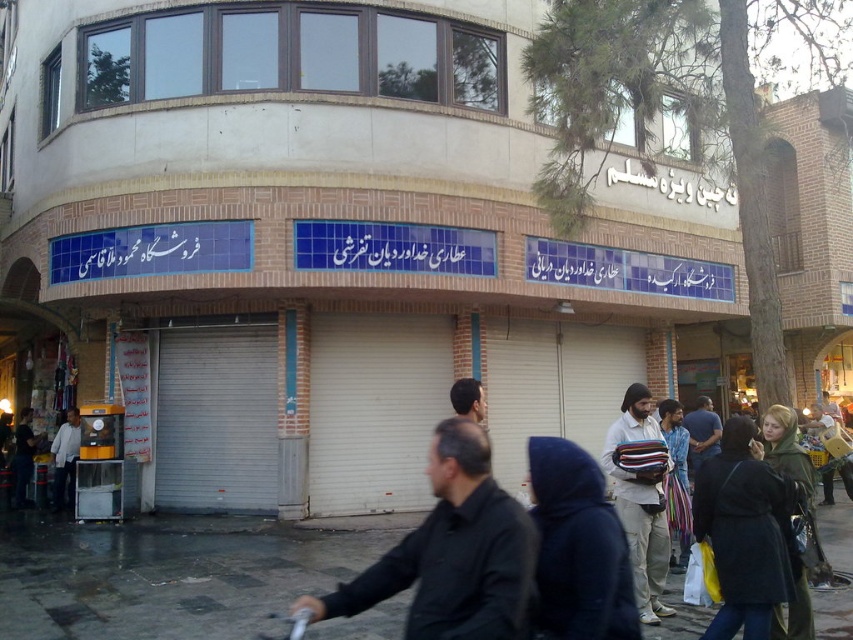
Who is more forward, (56, 504) or (711, 412)?

Point (711, 412) is in front.

Does light gray shirt at left have a lesser width compared to dark brown leather jacket at center?

No.

Does point (54, 502) come in front of point (715, 436)?

No, (54, 502) is behind (715, 436).

I want to click on light gray shirt at left, so click(65, 460).

Between dark gray asphalt at lower center and dark blue hooded jacket at lower center, which one is positioned lower?

dark gray asphalt at lower center

The image size is (853, 640). What do you see at coordinates (167, 573) in the screenshot?
I see `dark gray asphalt at lower center` at bounding box center [167, 573].

Is point (672, 573) less distant than point (601, 602)?

No.

Where is `dark gray asphalt at lower center`? This screenshot has width=853, height=640. dark gray asphalt at lower center is located at coordinates (167, 573).

Does black matte jacket at center have a greater height compared to dark blue coat at lower right?

No.

What are the coordinates of `black matte jacket at center` in the screenshot? It's located at (453, 552).

Where is `black matte jacket at center`? This screenshot has height=640, width=853. black matte jacket at center is located at coordinates pyautogui.click(x=453, y=552).